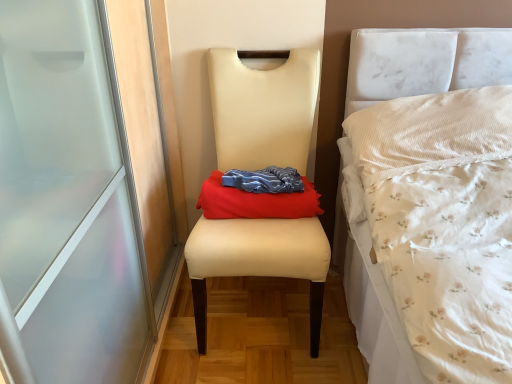
At what (x,y) coordinates should I click in order to perform the action: click on vacant area on top of red fabric cloth at center (from a real-world perspective). Please return your answer as a coordinate pair (x, y). This screenshot has height=384, width=512. Looking at the image, I should click on (252, 180).